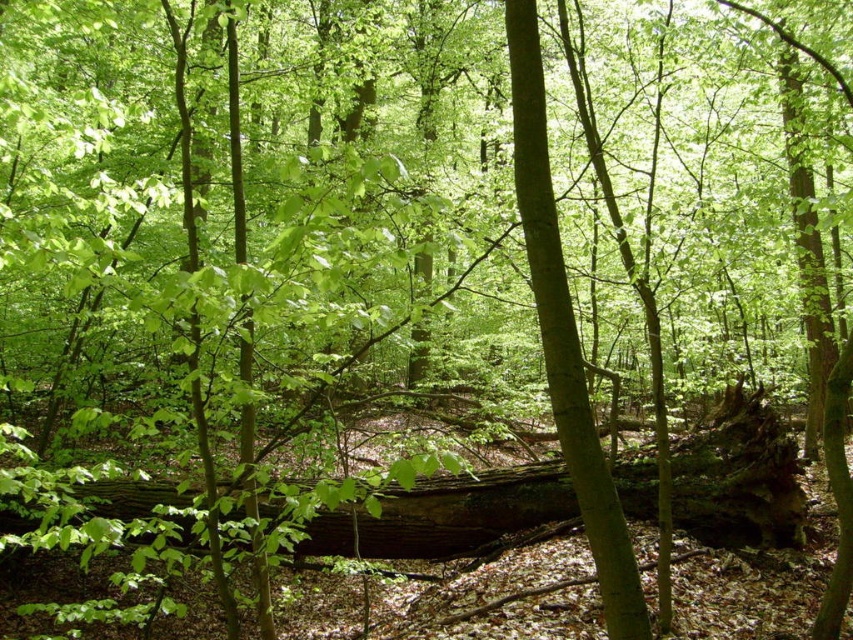
Is rough bark log at center taller than green matte tree trunk at center?

No, rough bark log at center is not taller than green matte tree trunk at center.

Which is below, rough bark log at center or green matte tree trunk at center?

Positioned lower is rough bark log at center.

What are the coordinates of `rough bark log at center` in the screenshot? It's located at (740, 477).